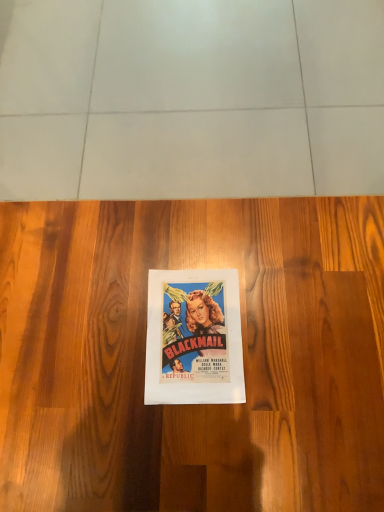
Question: Is matte paper poster at center taller than wooden floor at center?

Choices:
 (A) no
 (B) yes

Answer: (A)

Question: Is the position of matte paper poster at center less distant than that of wooden floor at center?

Choices:
 (A) no
 (B) yes

Answer: (A)

Question: Does matte paper poster at center have a larger size compared to wooden floor at center?

Choices:
 (A) no
 (B) yes

Answer: (A)

Question: From the image's perspective, would you say matte paper poster at center is shown under wooden floor at center?

Choices:
 (A) yes
 (B) no

Answer: (A)

Question: Is the depth of matte paper poster at center greater than that of wooden floor at center?

Choices:
 (A) yes
 (B) no

Answer: (A)

Question: From a real-world perspective, is matte paper poster at center positioned under wooden floor at center based on gravity?

Choices:
 (A) yes
 (B) no

Answer: (B)

Question: Is the depth of wooden floor at center less than that of matte paper poster at center?

Choices:
 (A) no
 (B) yes

Answer: (B)

Question: From the image's perspective, is wooden floor at center on top of matte paper poster at center?

Choices:
 (A) yes
 (B) no

Answer: (A)

Question: From the image's perspective, is wooden floor at center located beneath matte paper poster at center?

Choices:
 (A) no
 (B) yes

Answer: (A)

Question: From a real-world perspective, is wooden floor at center physically below matte paper poster at center?

Choices:
 (A) yes
 (B) no

Answer: (A)

Question: Is wooden floor at center positioned far away from matte paper poster at center?

Choices:
 (A) yes
 (B) no

Answer: (B)

Question: Considering the relative sizes of wooden floor at center and matte paper poster at center in the image provided, is wooden floor at center taller than matte paper poster at center?

Choices:
 (A) no
 (B) yes

Answer: (B)

Question: In terms of width, does wooden floor at center look wider or thinner when compared to matte paper poster at center?

Choices:
 (A) wide
 (B) thin

Answer: (A)